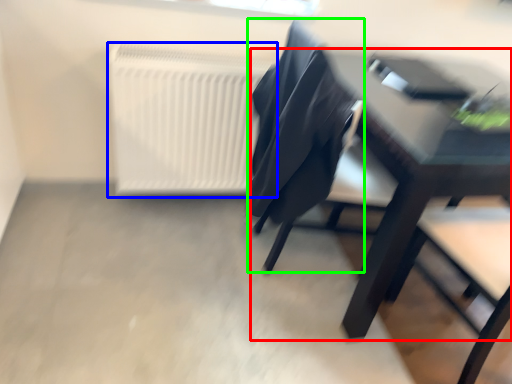
Question: Based on their relative distances, which object is farther from table (highlighted by a red box)? Choose from radiator (highlighted by a blue box) and chair (highlighted by a green box).

Choices:
 (A) radiator
 (B) chair

Answer: (A)